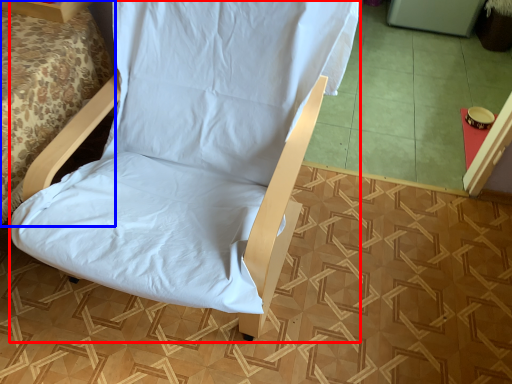
Question: Which object is further to the camera taking this photo, furnurniture (highlighted by a red box) or bed (highlighted by a blue box)?

Choices:
 (A) furnurniture
 (B) bed

Answer: (B)